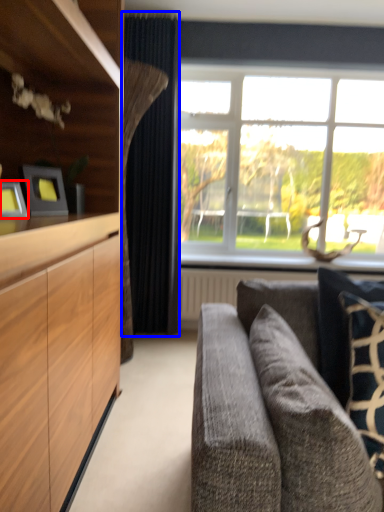
Question: Which point is closer to the camera, picture frame (highlighted by a red box) or curtain (highlighted by a blue box)?

Choices:
 (A) picture frame
 (B) curtain

Answer: (A)